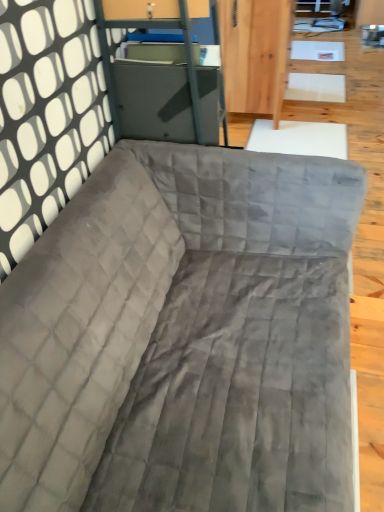
Question: Is matte gray metal file cabinet at upper center bigger or smaller than velvet gray couch at center?

Choices:
 (A) big
 (B) small

Answer: (B)

Question: From a real-world perspective, is matte gray metal file cabinet at upper center physically located above or below velvet gray couch at center?

Choices:
 (A) below
 (B) above

Answer: (B)

Question: Considering the positions of point (115, 26) and point (205, 231), is point (115, 26) closer or farther from the camera than point (205, 231)?

Choices:
 (A) farther
 (B) closer

Answer: (B)

Question: Relative to matte gray metal file cabinet at upper center, is velvet gray couch at center in front or behind?

Choices:
 (A) behind
 (B) front

Answer: (B)

Question: From the image's perspective, is velvet gray couch at center located above or below matte gray metal file cabinet at upper center?

Choices:
 (A) below
 (B) above

Answer: (A)

Question: Does point (218, 413) appear closer or farther from the camera than point (198, 135)?

Choices:
 (A) closer
 (B) farther

Answer: (A)

Question: Is velvet gray couch at center inside or outside of matte gray metal file cabinet at upper center?

Choices:
 (A) inside
 (B) outside

Answer: (B)